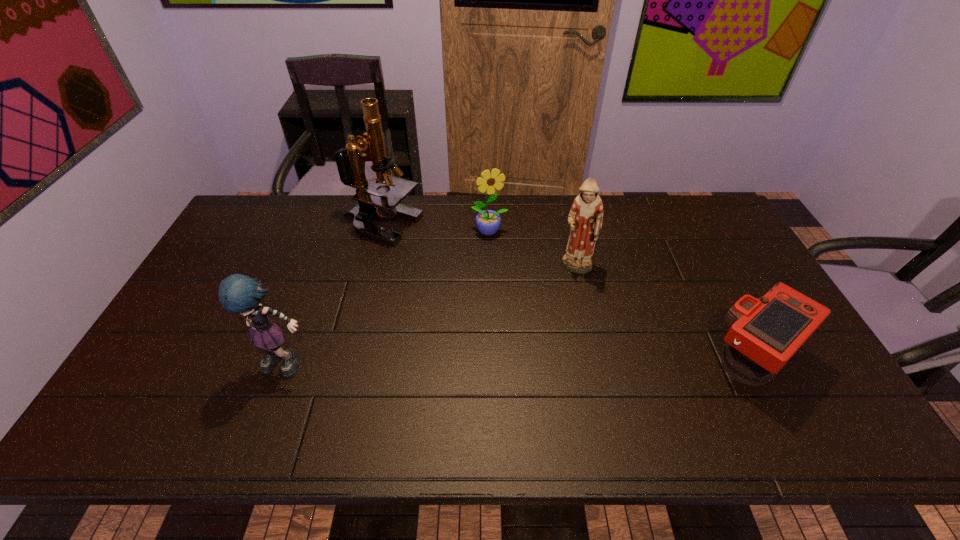
Where is `rag doll that is at the near edge`? This screenshot has height=540, width=960. rag doll that is at the near edge is located at coordinates (239, 294).

In order to click on camera present at the near edge in this screenshot , I will do `click(765, 332)`.

Find the location of `object that is at the right edge`. object that is at the right edge is located at coordinates (765, 332).

What are the coordinates of `object at the near right corner` in the screenshot? It's located at (765, 332).

In the image, there is a desktop. Where is `vacant space at the far edge`? The width and height of the screenshot is (960, 540). vacant space at the far edge is located at coordinates (427, 197).

Where is `free space at the near edge`? free space at the near edge is located at coordinates (723, 392).

At what (x,y) coordinates should I click in order to perform the action: click on free space at the left edge of the desktop. Please return your answer as a coordinate pair (x, y). Looking at the image, I should click on (194, 319).

Where is `vacant space at the right edge`? vacant space at the right edge is located at coordinates (733, 255).

At what (x,y) coordinates should I click in order to perform the action: click on vacant region at the far left corner. Please return your answer as a coordinate pair (x, y). Looking at the image, I should click on (252, 220).

The height and width of the screenshot is (540, 960). What are the coordinates of `vacant space at the far right corner of the desktop` in the screenshot? It's located at (708, 222).